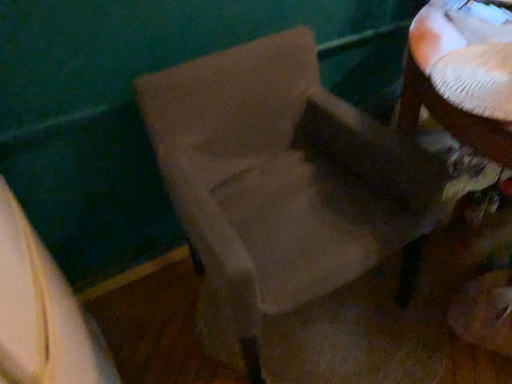
The height and width of the screenshot is (384, 512). Find the location of `free spot behind white fabric at lower left`. free spot behind white fabric at lower left is located at coordinates (145, 308).